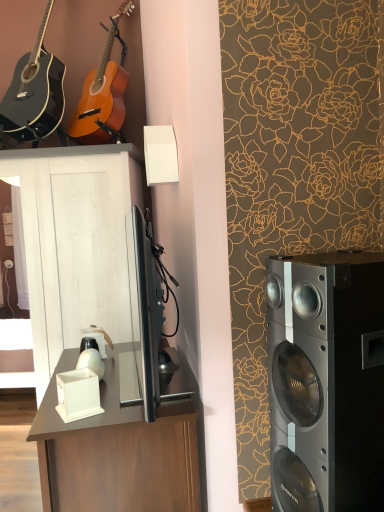
Question: Is white wood cabinet at center bigger or smaller than matte black acoustic guitar at upper left, marked as the 2th guitar in a right-to-left arrangement?

Choices:
 (A) big
 (B) small

Answer: (A)

Question: Do you think white wood cabinet at center is within matte black acoustic guitar at upper left, marked as the 2th guitar in a right-to-left arrangement, or outside of it?

Choices:
 (A) outside
 (B) inside

Answer: (A)

Question: Which of these objects is positioned closest to the white wood cabinet at center?

Choices:
 (A) matte black acoustic guitar at upper left, marked as the 2th guitar in a right-to-left arrangement
 (B) matte brown desk at center
 (C) orange wood guitar at upper left, which appears as the second guitar when viewed from the left
 (D) silver metallic speaker at right

Answer: (C)

Question: Considering the real-world distances, which object is farthest from the white wood cabinet at center?

Choices:
 (A) orange wood guitar at upper left, the 1th guitar viewed from the right
 (B) matte black acoustic guitar at upper left, marked as the 2th guitar in a right-to-left arrangement
 (C) matte brown desk at center
 (D) silver metallic speaker at right

Answer: (D)